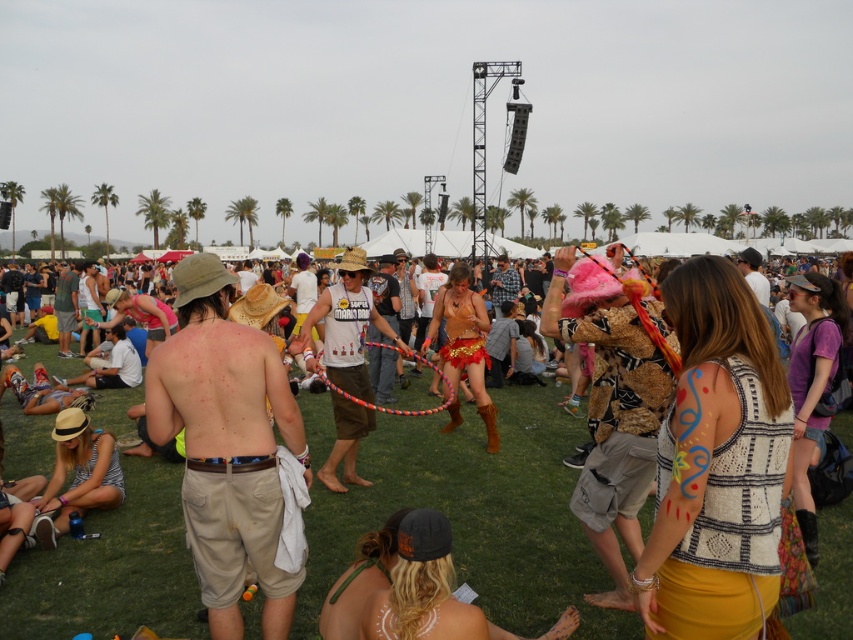
Question: Which of the following is the closest to the observer?

Choices:
 (A) checkered fabric shirt at center
 (B) matte green shirt at center

Answer: (A)

Question: Does tan cotton shorts at center have a lesser width compared to checkered fabric shirt at center?

Choices:
 (A) yes
 (B) no

Answer: (B)

Question: Is the position of matte gold hula hoop at center more distant than that of white printed tank top at center?

Choices:
 (A) yes
 (B) no

Answer: (B)

Question: Which of these objects is positioned farthest from the white printed tank top at center?

Choices:
 (A) matte green shirt at center
 (B) tan cotton shorts at center
 (C) matte white t-shirt at center

Answer: (A)

Question: Does tan cotton shorts at center have a lesser width compared to white printed tank top at center?

Choices:
 (A) no
 (B) yes

Answer: (B)

Question: Considering the real-world distances, which object is closest to the white printed tank top at center?

Choices:
 (A) matte green shirt at center
 (B) tan cotton shorts at center
 (C) matte white t-shirt at center

Answer: (B)